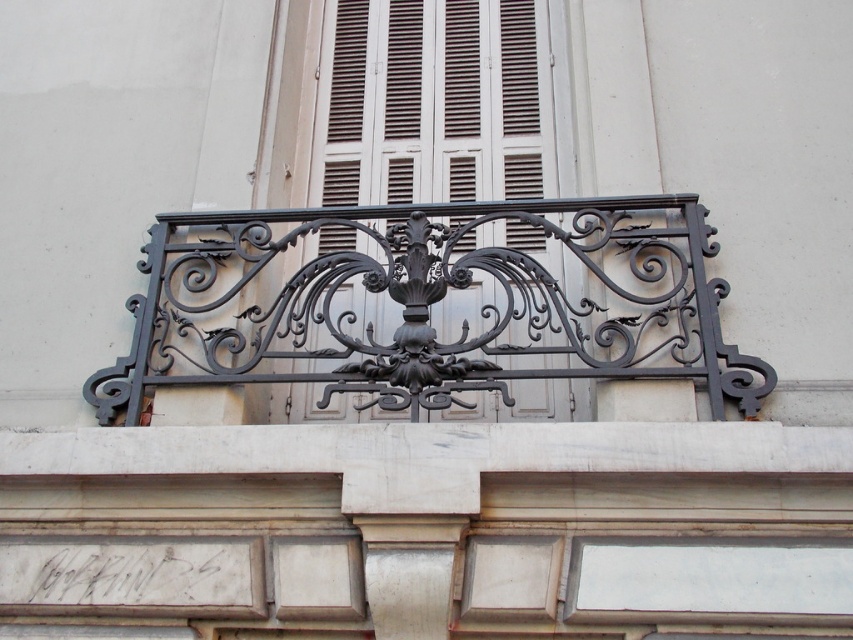
Between black wrought iron balustrade at center and brown matte shutter at center, which one appears on the right side from the viewer's perspective?

From the viewer's perspective, black wrought iron balustrade at center appears more on the right side.

Can you confirm if black wrought iron balustrade at center is thinner than brown matte shutter at center?

In fact, black wrought iron balustrade at center might be wider than brown matte shutter at center.

Between point (531, 342) and point (369, 76), which one is positioned in front?

Point (531, 342)

Find the location of `black wrought iron balustrade at center`. black wrought iron balustrade at center is located at coordinates (433, 301).